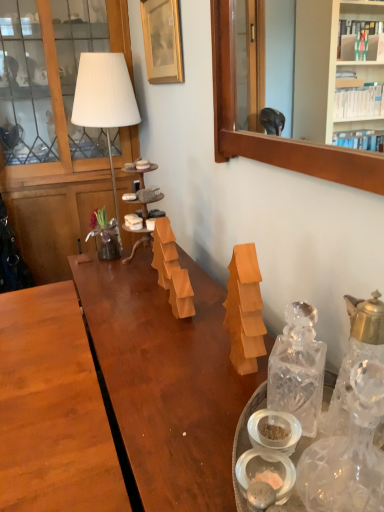
You are a GUI agent. You are given a task and a screenshot of the screen. Output one action in this format:
    pyautogui.click(x=<x>, y=<y>)
    Task: Click on the white matte spice container at center
    
    Given the screenshot: What is the action you would take?
    pyautogui.click(x=260, y=496)

This screenshot has height=512, width=384. What do you see at coordinates (355, 356) in the screenshot?
I see `clear glass carafe at right, the 2th bottle in the left-to-right sequence` at bounding box center [355, 356].

In order to click on white fabric lampshade at left in this screenshot , I will do `click(104, 98)`.

From a real-world perspective, which is physically above, translucent glass vase at center or clear glass carafe at right, which appears as the 1th bottle when viewed from the right?

In real-world perspective, clear glass carafe at right, which appears as the 1th bottle when viewed from the right, is above.

Consider the image. Can you tell me how much translucent glass vase at center and clear glass carafe at right, which appears as the 1th bottle when viewed from the right, differ in facing direction?

The facing directions of translucent glass vase at center and clear glass carafe at right, which appears as the 1th bottle when viewed from the right, are 1.21 degrees apart.

Is translucent glass vase at center facing towards clear glass carafe at right, the 2th bottle in the left-to-right sequence?

No, translucent glass vase at center is not oriented towards clear glass carafe at right, the 2th bottle in the left-to-right sequence.

Which object is more forward, translucent glass vase at center or clear glass carafe at right, which appears as the 1th bottle when viewed from the right?

Positioned in front is clear glass carafe at right, which appears as the 1th bottle when viewed from the right.

Which bottle is the 1st one when counting from the right side of the wooden tiered tray at center? Please provide its 2D coordinates.

[(298, 368)]

Considering the sizes of wooden tiered tray at center and transparent glass bottle at right, positioned as the first bottle in left-to-right order, in the image, is wooden tiered tray at center taller or shorter than transparent glass bottle at right, positioned as the first bottle in left-to-right order,?

wooden tiered tray at center is taller than transparent glass bottle at right, positioned as the first bottle in left-to-right order.

Is point (146, 207) closer or farther from the camera than point (292, 369)?

Clearly, point (146, 207) is more distant from the camera than point (292, 369).

Which is correct: transparent glass bottle at right, positioned as the first bottle in left-to-right order, is inside matte wood cabinet at left, or outside of it?

transparent glass bottle at right, positioned as the first bottle in left-to-right order, exists outside the volume of matte wood cabinet at left.

Consider the image. Is transparent glass bottle at right, positioned as the first bottle in left-to-right order, not close to matte wood cabinet at left?

Yes, transparent glass bottle at right, positioned as the first bottle in left-to-right order, is far from matte wood cabinet at left.

Is transparent glass bottle at right, positioned as the first bottle in left-to-right order, oriented towards matte wood cabinet at left?

No.

Is translucent glass vase at center thinner than white fabric lampshade at left?

Yes.

Consider the image. Is translucent glass vase at center far from white fabric lampshade at left?

That's not correct — translucent glass vase at center is a little close to white fabric lampshade at left.

Is translucent glass vase at center at the left side of white fabric lampshade at left?

No, translucent glass vase at center is not to the left of white fabric lampshade at left.

Who is smaller, translucent glass vase at center or white fabric lampshade at left?

translucent glass vase at center.

Based on the photo, in terms of width, does wooden frame at upper right look wider or thinner when compared to translucent glass vase at center?

Clearly, wooden frame at upper right has less width compared to translucent glass vase at center.

Is translucent glass vase at center surrounded by wooden frame at upper right?

That's incorrect, translucent glass vase at center is not inside wooden frame at upper right.

Is wooden frame at upper right at the left side of translucent glass vase at center?

Incorrect, wooden frame at upper right is not on the left side of translucent glass vase at center.

From a real-world perspective, is wooden picture frame at upper center physically above white fabric lampshade at left?

Yes, from a real-world perspective, wooden picture frame at upper center is above white fabric lampshade at left.

From the picture: Is wooden picture frame at upper center turned away from white fabric lampshade at left?

wooden picture frame at upper center is not turned away from white fabric lampshade at left.

Consider the image. Between wooden picture frame at upper center and white fabric lampshade at left, which one has larger width?

Wider between the two is white fabric lampshade at left.

Is wooden picture frame at upper center at the right side of matte wood cabinet at left?

Yes.

Is point (170, 39) positioned before point (45, 230)?

That is True.

You are a GUI agent. You are given a task and a screenshot of the screen. Output one action in this format:
    pyautogui.click(x=<x>, y=<y>)
    Task: Click on the picture frame on the right of matte wood cabinet at left
    
    Given the screenshot: What is the action you would take?
    pyautogui.click(x=162, y=41)

Is wooden picture frame at upper center oriented towards matte wood cabinet at left?

No, wooden picture frame at upper center is not facing towards matte wood cabinet at left.

Which bottle is the 2nd one when counting from the front of the translucent glass vase at center? Please provide its 2D coordinates.

[(355, 356)]

Image resolution: width=384 pixels, height=512 pixels. Identify the location of bottle that is the 2nd object directly below the wooden tiered tray at center (from a real-world perspective). [x=298, y=368].

From the image, which object appears to be farther from clear glass carafe at right, the 2th bottle in the left-to-right sequence, wooden picture frame at upper center or matte wood cabinet at left?

Among the two, matte wood cabinet at left is located further to clear glass carafe at right, the 2th bottle in the left-to-right sequence.

When comparing their distances from matte wood cabinet at left, does white fabric lampshade at left or clear glass carafe at right, the 2th bottle in the left-to-right sequence, seem closer?

white fabric lampshade at left is closer to matte wood cabinet at left.

Considering their positions, is wooden tiered tray at center positioned further to white matte spice container at center than clear glass carafe at right, the 2th bottle in the left-to-right sequence?

wooden tiered tray at center.

Estimate the real-world distances between objects in this image. Which object is further from wooden picture frame at upper center, translucent glass vase at center or wooden tiered tray at center?

translucent glass vase at center.

Which object lies nearer to the anchor point translucent glass vase at center, wooden picture frame at upper center or clear glass carafe at right, the 2th bottle in the left-to-right sequence?

wooden picture frame at upper center is closer to translucent glass vase at center.

Considering their positions, is matte wood cabinet at left positioned further to white matte spice container at center than clear glass carafe at right, which appears as the 1th bottle when viewed from the right?

Based on the image, matte wood cabinet at left appears to be further to white matte spice container at center.

Looking at the image, which one is located further to matte wood cabinet at left, transparent glass bottle at right, which is counted as the 2th bottle, starting from the right, or wooden picture frame at upper center?

transparent glass bottle at right, which is counted as the 2th bottle, starting from the right, is positioned further to the anchor matte wood cabinet at left.

From the image, which object appears to be nearer to white matte spice container at center, translucent glass vase at center or wooden frame at upper right?

translucent glass vase at center is closer to white matte spice container at center.

Where is `shelf between clear glass carafe at right, the 2th bottle in the left-to-right sequence, and matte wood cabinet at left, along the z-axis`? shelf between clear glass carafe at right, the 2th bottle in the left-to-right sequence, and matte wood cabinet at left, along the z-axis is located at coordinates (143, 225).

Identify the location of cabinetry between wooden picture frame at upper center and translucent glass vase at center in the up-down direction. (54, 127).

Where is `picture frame positioned between wooden frame at upper right and matte wood cabinet at left from near to far`? picture frame positioned between wooden frame at upper right and matte wood cabinet at left from near to far is located at coordinates (162, 41).

Where is `picture frame between white matte spice container at center and matte wood cabinet at left in the front-back direction`? Image resolution: width=384 pixels, height=512 pixels. picture frame between white matte spice container at center and matte wood cabinet at left in the front-back direction is located at coordinates (162, 41).